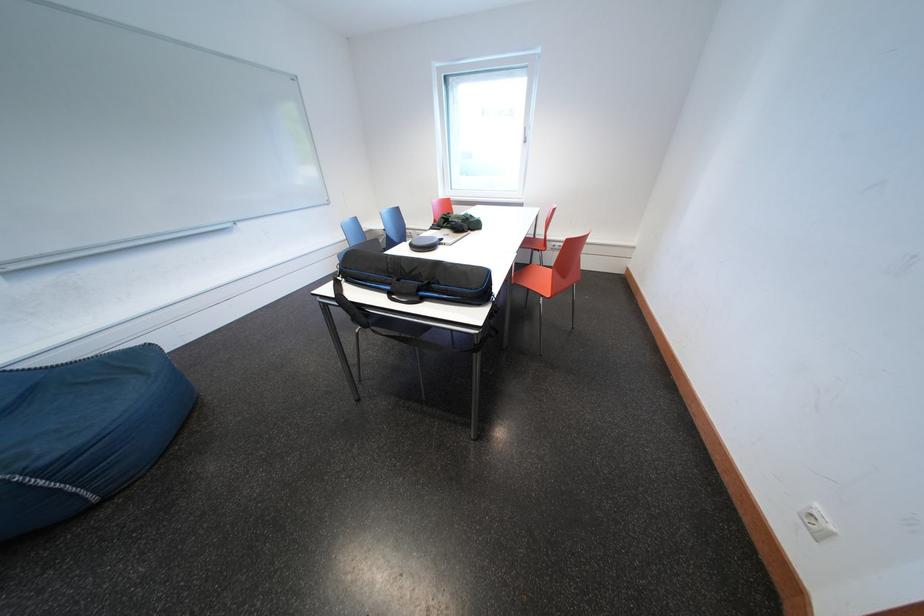
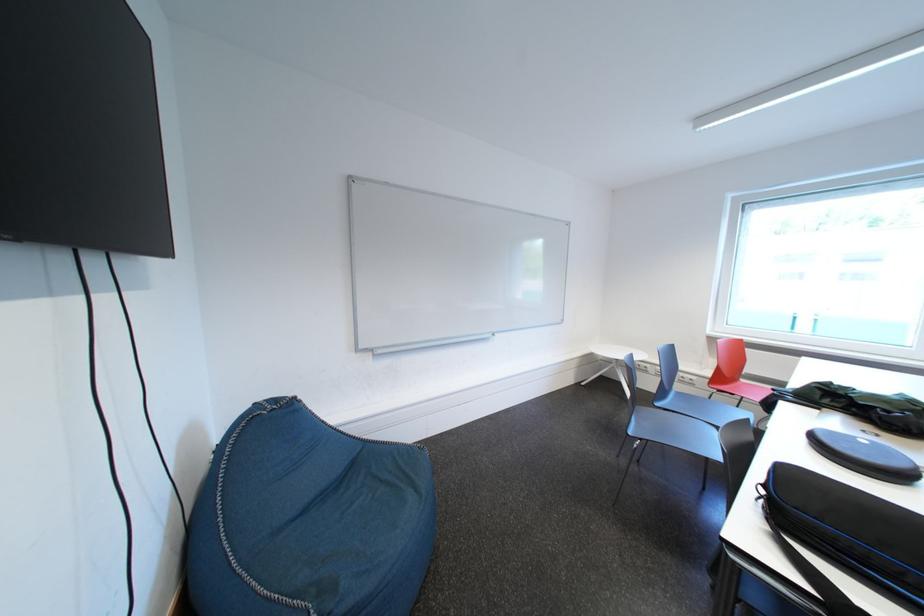
Find the pixel in the second image that matches (x=39, y=262) in the first image.

(397, 351)